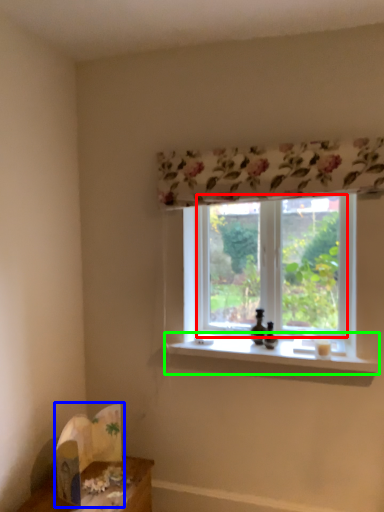
Question: Which object is the farthest from window screen (highlighted by a red box)? Choose among these: cardboard box (highlighted by a blue box) or window sill (highlighted by a green box).

Choices:
 (A) cardboard box
 (B) window sill

Answer: (A)